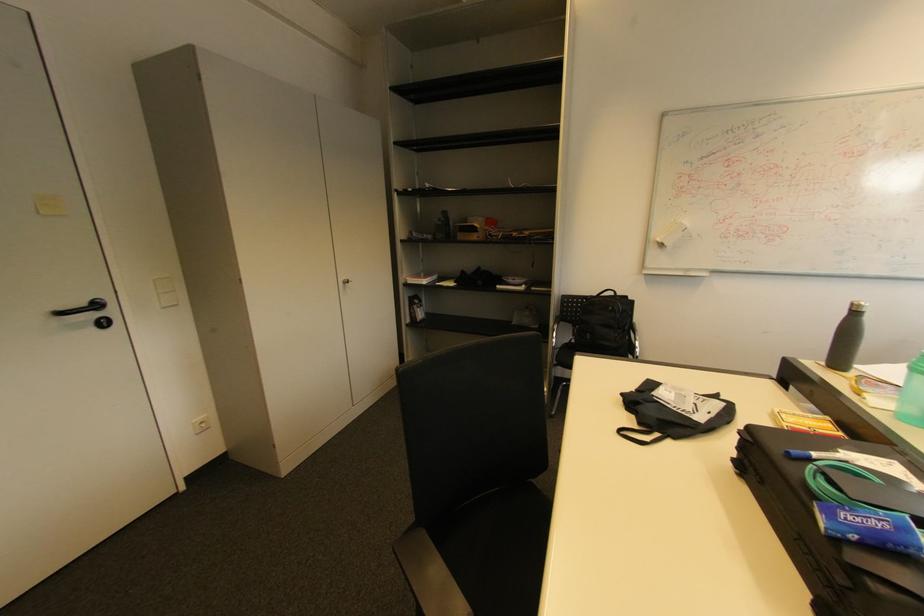
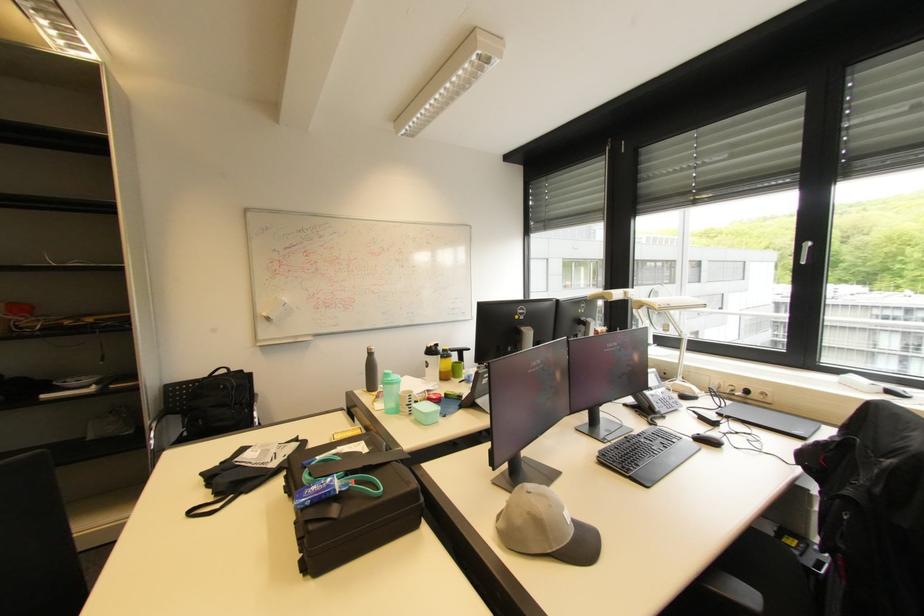
Where in the second image is the point corresponding to the point at 874,543 from the first image?

(321, 501)